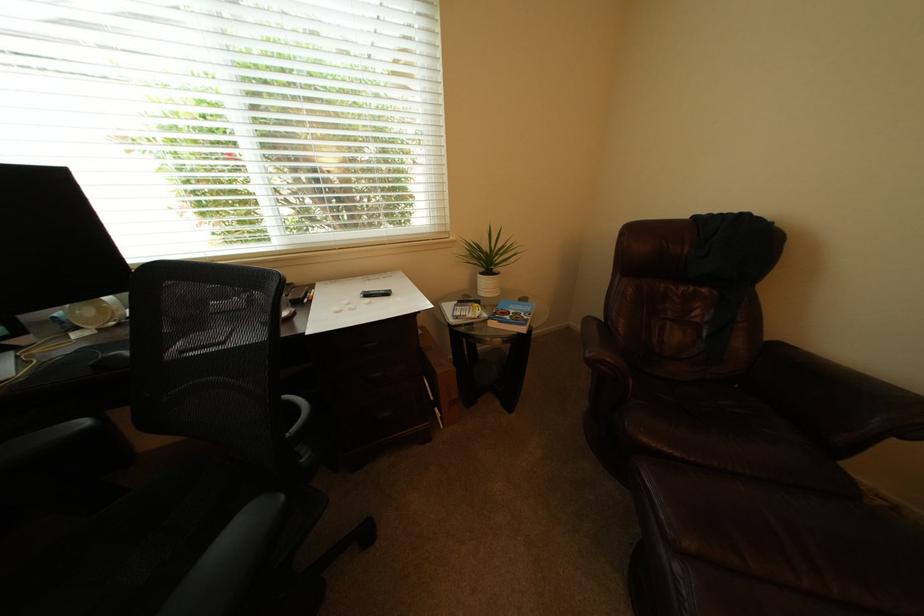
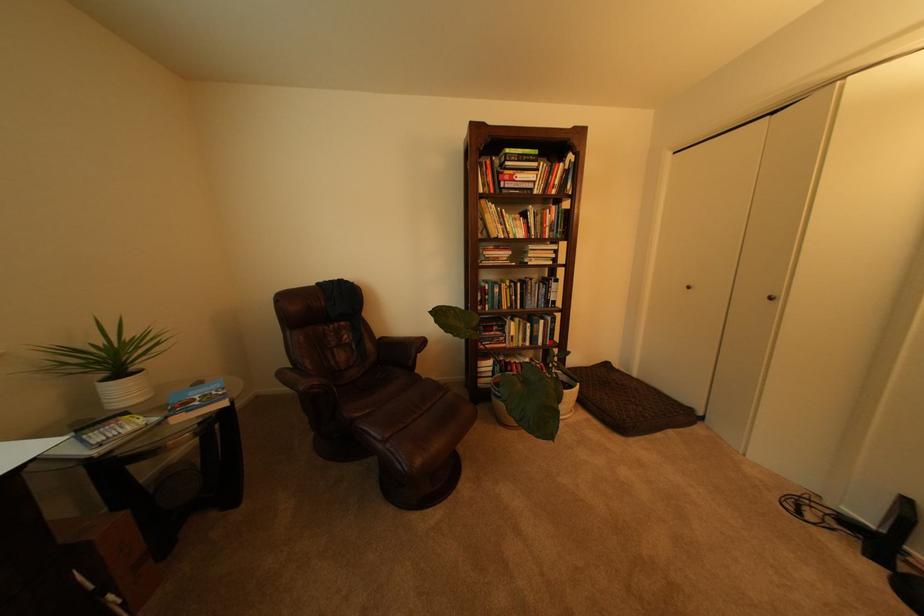
Find the pixel in the second image that matches point 505,272 in the first image.

(143, 370)